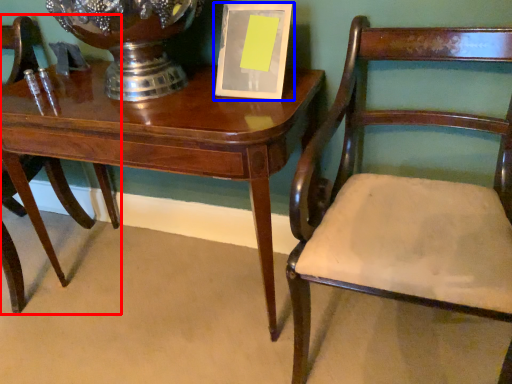
Question: Which of the following is the closest to the observer, chair (highlighted by a red box) or picture frame (highlighted by a blue box)?

Choices:
 (A) chair
 (B) picture frame

Answer: (B)